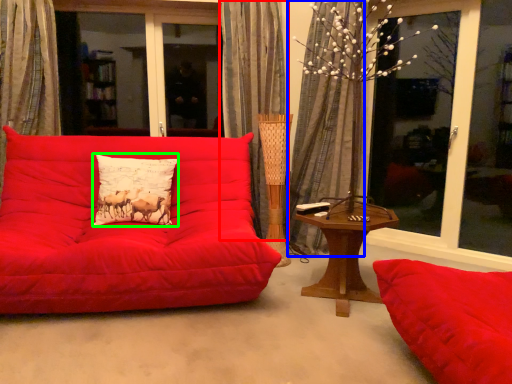
Question: Which object is the farthest from curtain (highlighted by a red box)? Choose among these: curtain (highlighted by a blue box) or pillow (highlighted by a green box).

Choices:
 (A) curtain
 (B) pillow

Answer: (B)